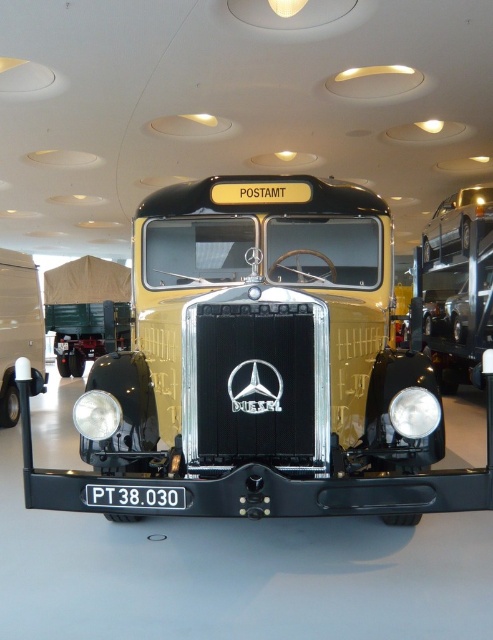
You are standing at the entrance of the museum and see the vintage Mercedes truck. There is a shiny silver car represented by point (456, 221). Where is the shiny silver car located relative to the truck?

The shiny silver car represented by point (456, 221) is located at the upper right relative to the truck.

You are a tour guide explaining the vintage Mercedes truck to visitors. Pointing to the black plastic license plate at center and the matte silver headlight at center, you want to clarify their positioning. Which object is positioned to the right side of the other?

The black plastic license plate at center is to the right of the matte silver headlight at center.

You are standing in the museum and want to take a photo of the vintage Mercedes truck. You notice two points marked on the floor at coordinates point (437, 413) and point (110, 404). Which point should you stand at to ensure the truck is fully visible without any obstruction?

You should stand at point (110, 404) because point (437, 413) is in front of it, meaning standing at the latter would block the view of the truck.